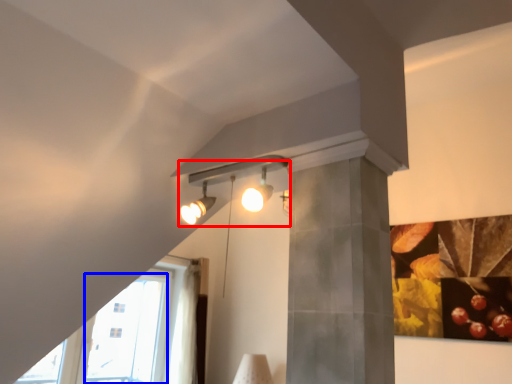
Question: Among these objects, which one is farthest to the camera, lamp (highlighted by a red box) or glass door (highlighted by a blue box)?

Choices:
 (A) lamp
 (B) glass door

Answer: (B)